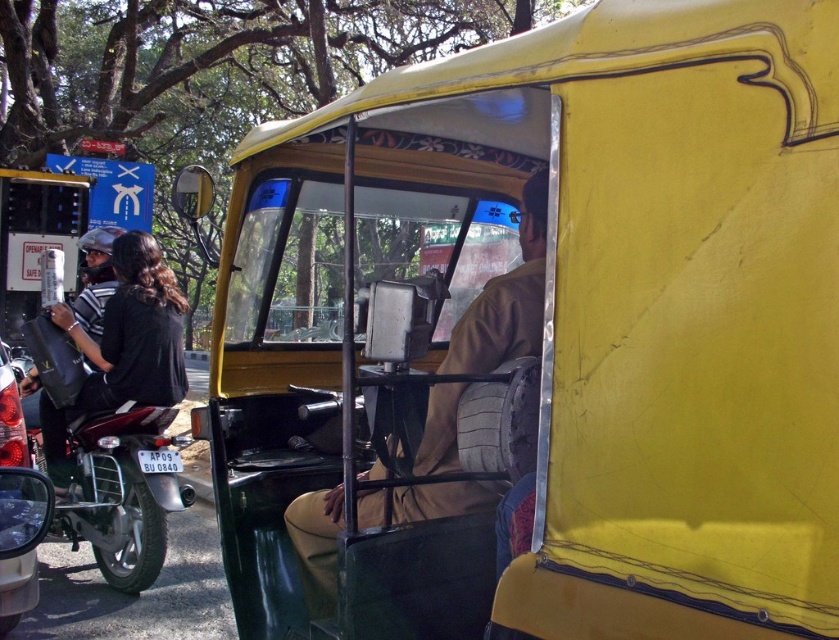
Question: Can you confirm if light brown fabric seat at center is bigger than shiny black motorcycle at left?

Choices:
 (A) no
 (B) yes

Answer: (A)

Question: Which of the following is the farthest from the observer?

Choices:
 (A) light brown fabric seat at center
 (B) black leather jacket at left
 (C) shiny black motorcycle at left

Answer: (B)

Question: Among these objects, which one is nearest to the camera?

Choices:
 (A) shiny black motorcycle at left
 (B) black leather jacket at left

Answer: (A)

Question: Which point is farther from the camera taking this photo?

Choices:
 (A) (529, 340)
 (B) (150, 568)
 (C) (129, 348)

Answer: (C)

Question: Does black leather jacket at left appear under shiny black motorcycle at left?

Choices:
 (A) yes
 (B) no

Answer: (B)

Question: Does light brown fabric seat at center appear on the right side of shiny black motorcycle at left?

Choices:
 (A) yes
 (B) no

Answer: (A)